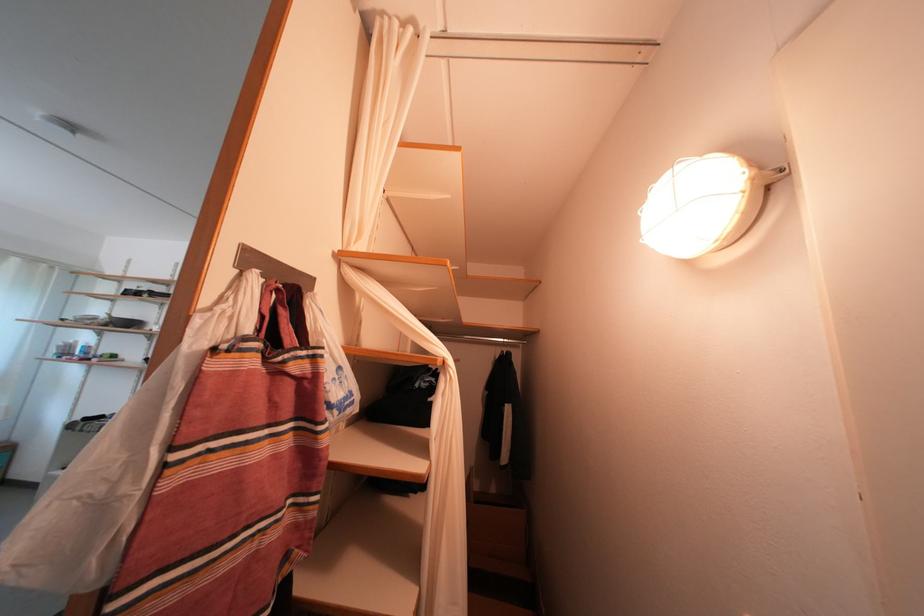
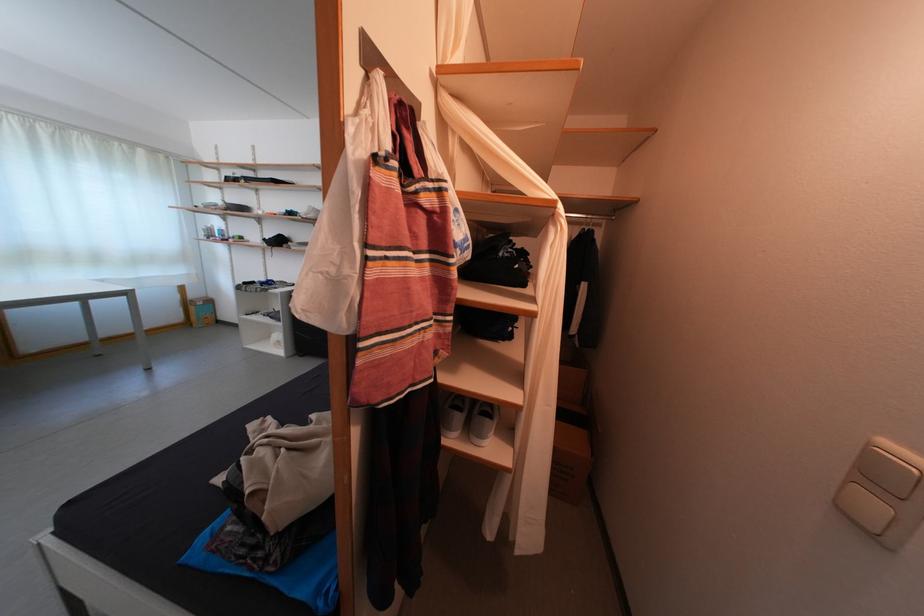
Question: How did the camera likely rotate?

Choices:
 (A) Left
 (B) Right
 (C) Up
 (D) Down

Answer: (D)